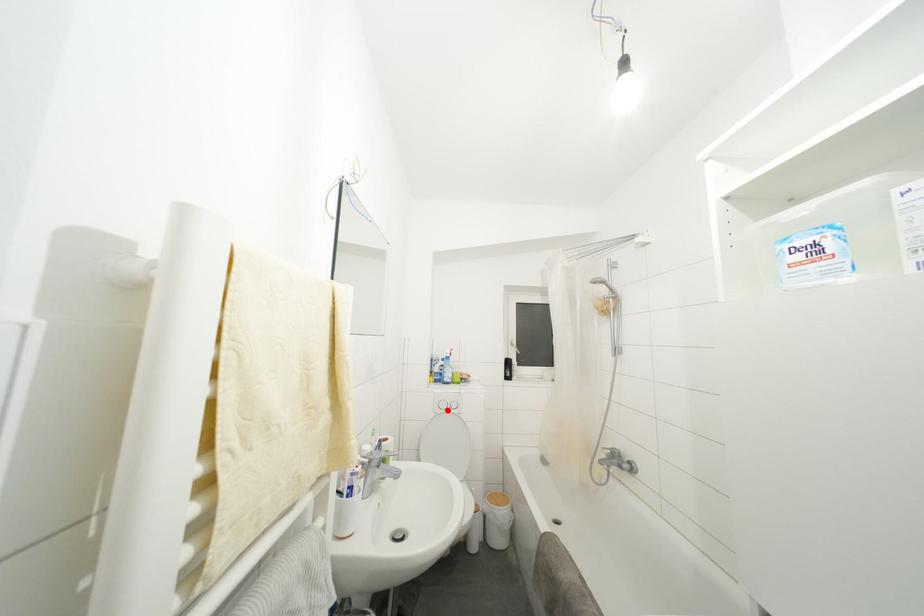
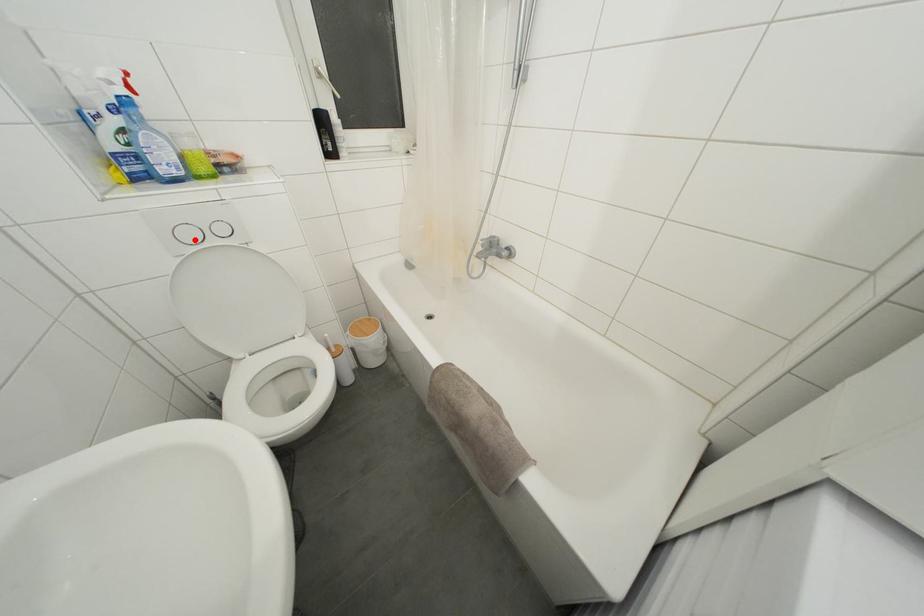
I am providing you with two images of the same scene from different viewpoints. A red point is marked on the first image and another point is marked on the second image. Is the red point in image1 aligned with the point shown in image2?

Yes